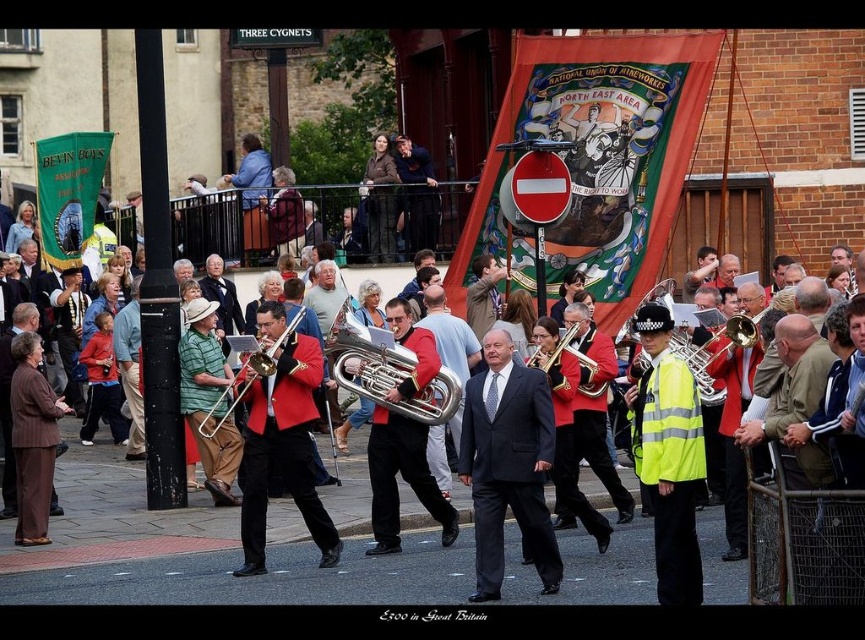
Can you confirm if shiny red jacket at center is bigger than shiny brass tuba at center?

Correct, shiny red jacket at center is larger in size than shiny brass tuba at center.

Which of these two, shiny red jacket at center or shiny brass tuba at center, stands taller?

shiny red jacket at center is taller.

Where is `shiny red jacket at center`? This screenshot has width=865, height=640. shiny red jacket at center is located at coordinates pyautogui.click(x=594, y=404).

The height and width of the screenshot is (640, 865). I want to click on shiny red jacket at center, so click(x=594, y=404).

Locate an element on the screen. The image size is (865, 640). shiny red jacket at center is located at coordinates (594, 404).

Who is more forward, (600, 401) or (584, 385)?

Point (584, 385) is in front.

Describe the element at coordinates (594, 404) in the screenshot. I see `shiny red jacket at center` at that location.

Locate an element on the screen. shiny red jacket at center is located at coordinates pos(594,404).

What do you see at coordinates (507, 465) in the screenshot? Image resolution: width=865 pixels, height=640 pixels. I see `dark gray suit at center` at bounding box center [507, 465].

Who is positioned more to the right, dark gray suit at center or brass shiny trumpet at center?

brass shiny trumpet at center is more to the right.

Image resolution: width=865 pixels, height=640 pixels. Describe the element at coordinates (507, 465) in the screenshot. I see `dark gray suit at center` at that location.

The width and height of the screenshot is (865, 640). Identify the location of dark gray suit at center. (507, 465).